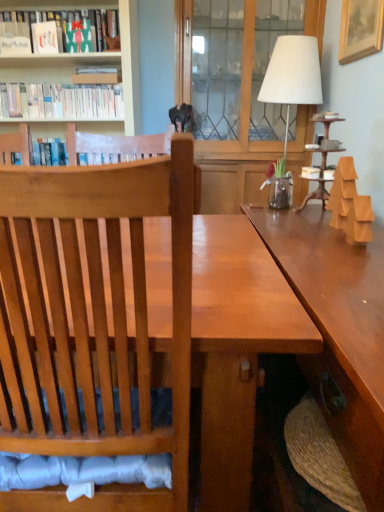
You are a GUI agent. You are given a task and a screenshot of the screen. Output one action in this format:
    pyautogui.click(x=<x>, y=<y>)
    Task: Click on the white fabric lampshade at upper right
    
    Given the screenshot: What is the action you would take?
    pyautogui.click(x=293, y=74)

Find the location of a particular element. The width and height of the screenshot is (384, 512). matte cardboard box at upper left, which appears as the second book when viewed from the top is located at coordinates (97, 75).

Image resolution: width=384 pixels, height=512 pixels. What do you see at coordinates (245, 98) in the screenshot?
I see `transparent glass door at center` at bounding box center [245, 98].

Find the location of `shiny brown table at center`. shiny brown table at center is located at coordinates tap(236, 346).

Locate an element on the screen. This screenshot has height=512, width=384. white matte bookshelf at upper left, which is the 3th book from top to bottom is located at coordinates (61, 101).

Between white matte bookshelf at upper left, which is the 3th book from top to bottom, and white fabric lampshade at upper right, which one is positioned in front?

white fabric lampshade at upper right.

From a real-world perspective, does white matte bookshelf at upper left, which is the 3th book from top to bottom, stand above white fabric lampshade at upper right?

Correct, in the physical world, white matte bookshelf at upper left, which is the 3th book from top to bottom, is higher than white fabric lampshade at upper right.

Considering the positions of points (30, 113) and (308, 40), is point (30, 113) closer to camera compared to point (308, 40)?

No.

Which point is more distant from viewer, [182,21] or [344,40]?

Point [182,21]

Between transparent glass door at center and gold wooden picture frame at upper right, which one appears on the left side from the viewer's perspective?

Positioned to the left is transparent glass door at center.

Where is `glass door behind the gold wooden picture frame at upper right`? The width and height of the screenshot is (384, 512). glass door behind the gold wooden picture frame at upper right is located at coordinates (245, 98).

Is point (92, 80) closer or farther from the camera than point (319, 57)?

Point (92, 80) is closer to the camera than point (319, 57).

Find the location of a particular element. glass door that is on the right side of matte cardboard box at upper left, positioned as the 2th book in bottom-to-top order is located at coordinates (245, 98).

From the image's perspective, is matte cardboard box at upper left, which appears as the second book when viewed from the top, above or below transparent glass door at center?

Based on their image positions, matte cardboard box at upper left, which appears as the second book when viewed from the top, is located above transparent glass door at center.

From their relative heights in the image, would you say matte cardboard box at upper left, which appears as the second book when viewed from the top, is taller or shorter than transparent glass door at center?

In the image, matte cardboard box at upper left, which appears as the second book when viewed from the top, appears to be shorter than transparent glass door at center.

Based on the photo, between shiny brown table at center and white matte bookshelf at upper left, which is the 3th book from top to bottom, which one has smaller size?

Smaller between the two is white matte bookshelf at upper left, which is the 3th book from top to bottom.

From a real-world perspective, who is located lower, shiny brown table at center or white matte bookshelf at upper left, which appears as the first book when ordered from the bottom?

shiny brown table at center.

Considering the relative sizes of shiny brown table at center and white matte bookshelf at upper left, which is the 3th book from top to bottom, in the image provided, is shiny brown table at center thinner than white matte bookshelf at upper left, which is the 3th book from top to bottom,?

No.

Would you say matte cardboard box at upper left, positioned as the 2th book in bottom-to-top order, is outside white fabric lampshade at upper right?

Yes, matte cardboard box at upper left, positioned as the 2th book in bottom-to-top order, is not within white fabric lampshade at upper right.

Which is in front, point (85, 71) or point (311, 99)?

The point (311, 99) is in front.

Is the surface of matte cardboard box at upper left, positioned as the 2th book in bottom-to-top order, in direct contact with white fabric lampshade at upper right?

matte cardboard box at upper left, positioned as the 2th book in bottom-to-top order, and white fabric lampshade at upper right are not in contact.

Find the location of `table below the matte green book at upper left, which is counted as the first book, starting from the top (from a real-world perspective)`. table below the matte green book at upper left, which is counted as the first book, starting from the top (from a real-world perspective) is located at coordinates (236, 346).

Between matte green book at upper left, which is counted as the first book, starting from the top, and shiny brown table at center, which one has more height?

Standing taller between the two is shiny brown table at center.

From the picture: From the image's perspective, is matte green book at upper left, the 3th book from the bottom, above shiny brown table at center?

Correct, matte green book at upper left, the 3th book from the bottom, appears higher than shiny brown table at center in the image.

What's the angular difference between matte cardboard box at upper left, positioned as the 2th book in bottom-to-top order, and matte green book at upper left, the 3th book from the bottom,'s facing directions?

The angle between the facing direction of matte cardboard box at upper left, positioned as the 2th book in bottom-to-top order, and the facing direction of matte green book at upper left, the 3th book from the bottom, is 2.34 degrees.

Does matte cardboard box at upper left, positioned as the 2th book in bottom-to-top order, have a smaller size compared to matte green book at upper left, which is counted as the first book, starting from the top?

Correct, matte cardboard box at upper left, positioned as the 2th book in bottom-to-top order, occupies less space than matte green book at upper left, which is counted as the first book, starting from the top.

Which is in front, point (118, 79) or point (78, 42)?

The point (78, 42) is more forward.

Is matte cardboard box at upper left, positioned as the 2th book in bottom-to-top order, positioned with its back to matte green book at upper left, the 3th book from the bottom?

No, matte cardboard box at upper left, positioned as the 2th book in bottom-to-top order, is not facing the opposite direction of matte green book at upper left, the 3th book from the bottom.

Image resolution: width=384 pixels, height=512 pixels. What are the coordinates of `book that is the 3rd one when counting leftward from the white fabric lampshade at upper right` in the screenshot? It's located at (61, 101).

This screenshot has width=384, height=512. Identify the location of picture frame in front of the transparent glass door at center. [360, 29].

When comparing their distances from white fabric lampshade at upper right, does gold wooden picture frame at upper right or matte green book at upper left, which is counted as the first book, starting from the top, seem closer?

gold wooden picture frame at upper right is closer to white fabric lampshade at upper right.

Estimate the real-world distances between objects in this image. Which object is further from shiny brown table at center, white fabric lampshade at upper right or matte cardboard box at upper left, positioned as the 2th book in bottom-to-top order?

Based on the image, matte cardboard box at upper left, positioned as the 2th book in bottom-to-top order, appears to be further to shiny brown table at center.

Looking at the image, which one is located further to matte cardboard box at upper left, which appears as the second book when viewed from the top, transparent glass door at center or gold wooden picture frame at upper right?

gold wooden picture frame at upper right is positioned further to the anchor matte cardboard box at upper left, which appears as the second book when viewed from the top.

Which object lies further to the anchor point shiny brown table at center, matte cardboard box at upper left, which appears as the second book when viewed from the top, or transparent glass door at center?

Among the two, matte cardboard box at upper left, which appears as the second book when viewed from the top, is located further to shiny brown table at center.

Looking at the image, which one is located closer to white fabric lampshade at upper right, matte green book at upper left, the 3th book from the bottom, or white matte bookshelf at upper left, which is the 3th book from top to bottom?

matte green book at upper left, the 3th book from the bottom, is positioned closer to the anchor white fabric lampshade at upper right.

In the scene shown: Estimate the real-world distances between objects in this image. Which object is closer to gold wooden picture frame at upper right, matte green book at upper left, which is counted as the first book, starting from the top, or matte cardboard box at upper left, positioned as the 2th book in bottom-to-top order?

matte green book at upper left, which is counted as the first book, starting from the top, lies closer to gold wooden picture frame at upper right than the other object.

In the scene shown: Estimate the real-world distances between objects in this image. Which object is closer to white fabric lampshade at upper right, gold wooden picture frame at upper right or shiny brown table at center?

The object closer to white fabric lampshade at upper right is gold wooden picture frame at upper right.

Considering their positions, is white matte bookshelf at upper left, which is the 3th book from top to bottom, positioned further to matte green book at upper left, which is counted as the first book, starting from the top, than gold wooden picture frame at upper right?

The object further to matte green book at upper left, which is counted as the first book, starting from the top, is gold wooden picture frame at upper right.

The height and width of the screenshot is (512, 384). I want to click on glass door between matte green book at upper left, the 3th book from the bottom, and white fabric lampshade at upper right, in the horizontal direction, so click(x=245, y=98).

The height and width of the screenshot is (512, 384). I want to click on glass door between white matte bookshelf at upper left, which appears as the first book when ordered from the bottom, and gold wooden picture frame at upper right, in the horizontal direction, so click(245, 98).

Where is `picture frame located between shiny brown table at center and transparent glass door at center in the depth direction`? picture frame located between shiny brown table at center and transparent glass door at center in the depth direction is located at coordinates (360, 29).

Find the location of a particular element. book located between matte green book at upper left, which is counted as the first book, starting from the top, and transparent glass door at center in the left-right direction is located at coordinates point(97,75).